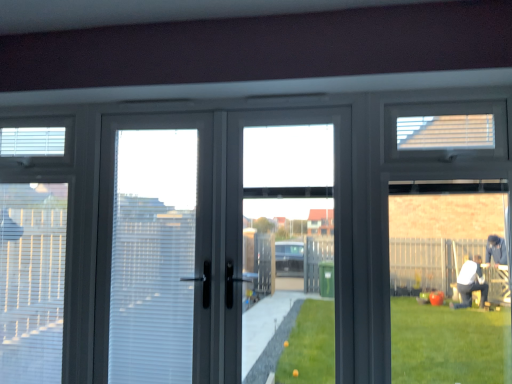
Question: Does white matte blind at upper right, positioned as the third blind in left-to-right order, come behind matte gray screen door at center?

Choices:
 (A) yes
 (B) no

Answer: (B)

Question: Is white matte blind at upper right, arranged as the third blind when ordered from the bottom, oriented away from matte gray screen door at center?

Choices:
 (A) no
 (B) yes

Answer: (A)

Question: From the image's perspective, would you say white matte blind at upper right, which ranks as the first blind in top-to-bottom order, is positioned over matte gray screen door at center?

Choices:
 (A) no
 (B) yes

Answer: (B)

Question: Is white matte blind at upper right, positioned as the third blind in left-to-right order, to the right of matte gray screen door at center from the viewer's perspective?

Choices:
 (A) no
 (B) yes

Answer: (B)

Question: Is white matte blind at upper right, positioned as the third blind in left-to-right order, located outside matte gray screen door at center?

Choices:
 (A) no
 (B) yes

Answer: (B)

Question: Visually, is white textured blind at left, arranged as the 1th blind when ordered from the bottom, positioned to the left or to the right of white matte blind at upper right, the 1th blind from the right?

Choices:
 (A) left
 (B) right

Answer: (A)

Question: Is point (5, 311) closer or farther from the camera than point (425, 135)?

Choices:
 (A) closer
 (B) farther

Answer: (B)

Question: Is white textured blind at left, which ranks as the second blind in front-to-back order, taller or shorter than white matte blind at upper right, the third blind in the back-to-front sequence?

Choices:
 (A) tall
 (B) short

Answer: (A)

Question: From the image's perspective, relative to white matte blind at upper right, positioned as the 1th blind in front-to-back order, is white textured blind at left, the third blind when ordered from top to bottom, above or below?

Choices:
 (A) above
 (B) below

Answer: (B)

Question: Based on their sizes in the image, would you say white matte blind at upper right, arranged as the third blind when ordered from the bottom, is bigger or smaller than transparent glass door at center?

Choices:
 (A) big
 (B) small

Answer: (B)

Question: Does point (445, 139) appear closer or farther from the camera than point (245, 122)?

Choices:
 (A) farther
 (B) closer

Answer: (B)

Question: Is white matte blind at upper right, positioned as the 1th blind in front-to-back order, taller or shorter than transparent glass door at center?

Choices:
 (A) short
 (B) tall

Answer: (A)

Question: From the image's perspective, is white matte blind at upper right, positioned as the 1th blind in front-to-back order, above or below transparent glass door at center?

Choices:
 (A) below
 (B) above

Answer: (B)

Question: Considering their positions, is white plastic blind at upper left, placed as the 2th blind when sorted from bottom to top, located in front of or behind matte gray screen door at center?

Choices:
 (A) front
 (B) behind

Answer: (B)

Question: Looking at the image, does white plastic blind at upper left, acting as the first blind starting from the left, seem bigger or smaller compared to matte gray screen door at center?

Choices:
 (A) big
 (B) small

Answer: (B)